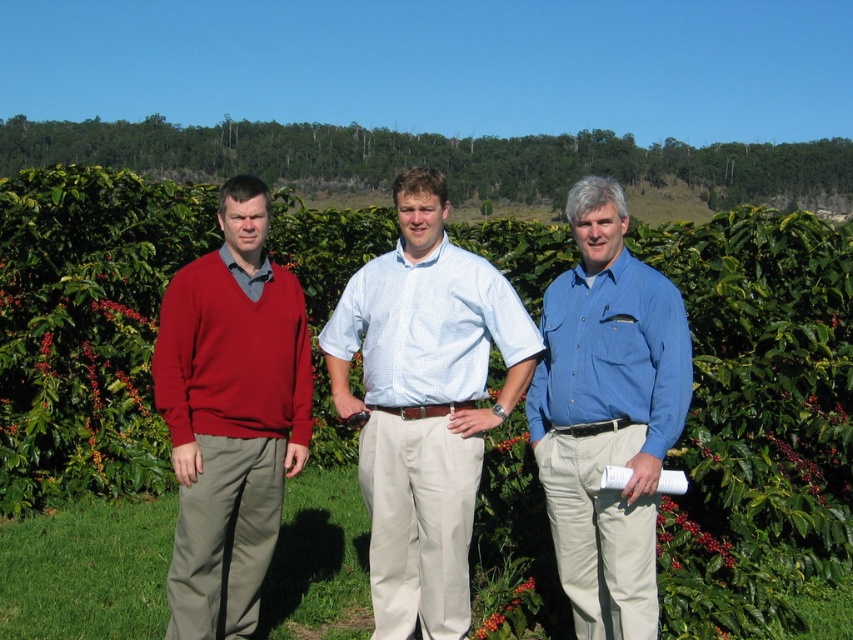
You are standing at the origin point in the image. There are two points marked in the scene. Which point is closer to you, point (x=299, y=353) or point (x=544, y=323)?

Point (x=544, y=323) is closer to you because it is in front of point (x=299, y=353).

What is the exact coordinate of the green leafy vines at center?

The green leafy vines at center are located at point (757, 419).